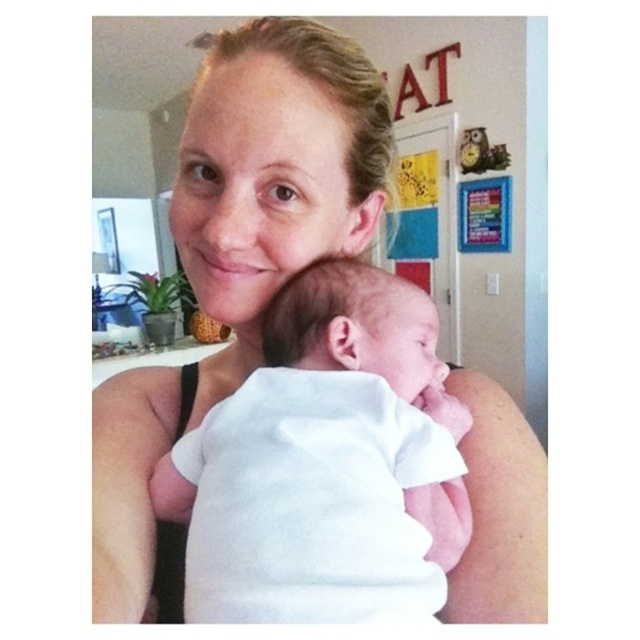
You are standing in the room and want to reach the point marked at coordinates point (470, 387). If your arm can extend 24 inches, can you touch that point without moving your feet?

The distance between you and point (470, 387) is 25.39 inches. Since your arm can only extend 24 inches, you cannot reach the point without moving your feet.

You are standing in the room and see two points marked on the wall. The first point is at position point [296,129] and the second point is at position point [308,422]. Which point is closer to you?

Point [308,422] is closer to you because it is in front of point [296,129].